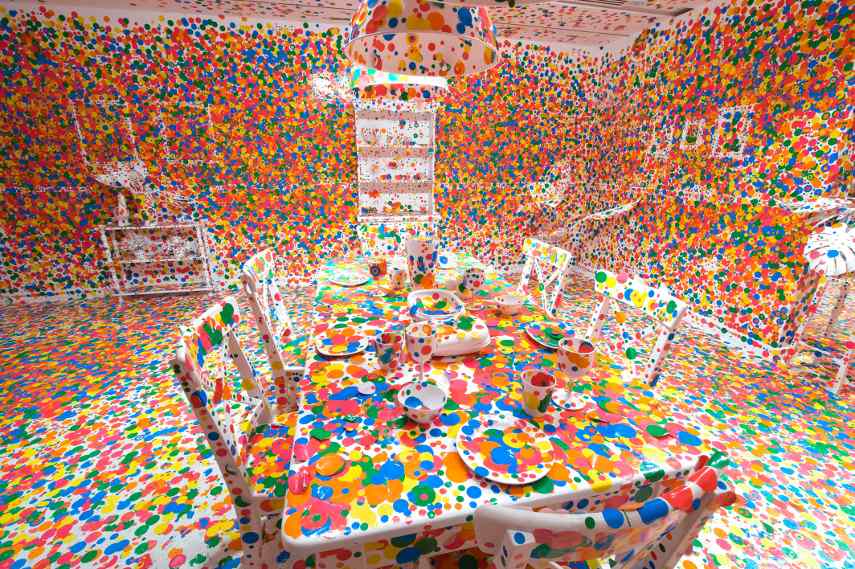
Identify the location of chair. This screenshot has height=569, width=855. (274, 351).